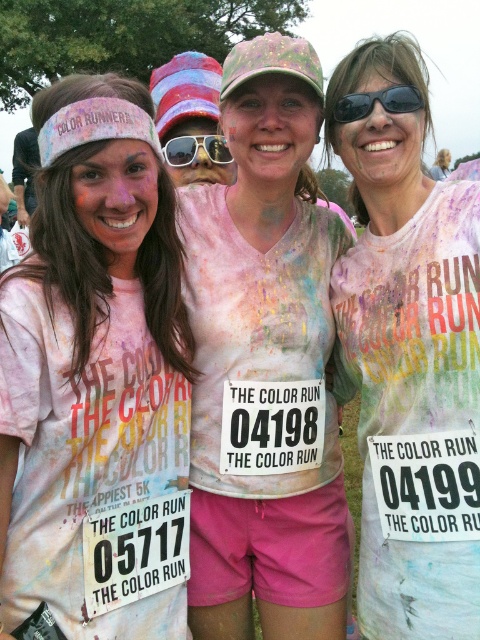
You are a photographer at The Color Run event. You want to take a photo of the matte white headband at upper left and sunglasses at center. The minimum distance required between subjects for your camera to focus on both is 5 feet. Can you capture both in one shot?

The distance between the matte white headband at upper left and sunglasses at center is 4.71 feet, which is less than the 5 feet requirement. Therefore, the camera cannot focus on both subjects simultaneously.

You are a photographer at the event and want to capture a clear photo of the black plastic sunglasses at upper center and the sunglasses at center. Which one will appear closer to the camera in the photo?

The black plastic sunglasses at upper center will appear closer to the camera in the photo because it is in front of the sunglasses at center.